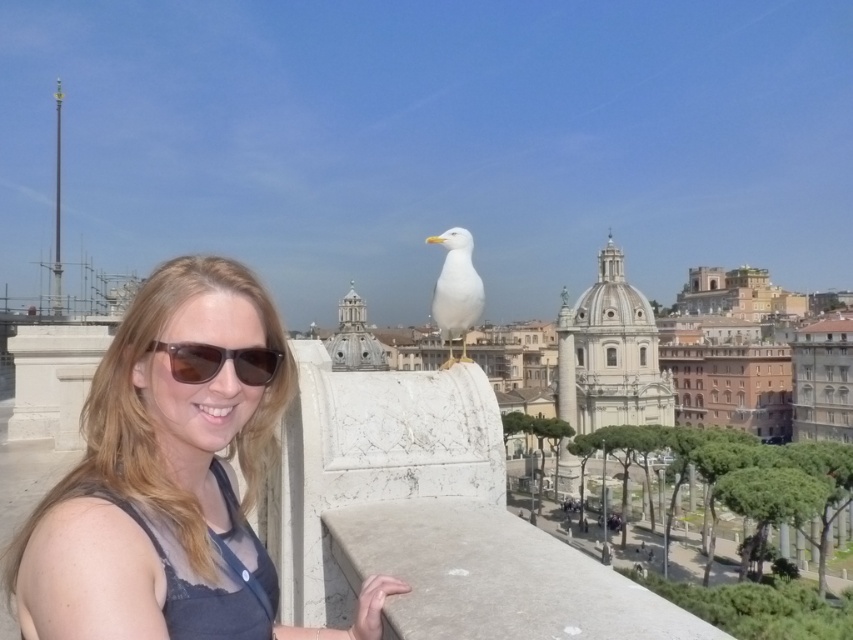
Question: Can you confirm if matte gray tank top at center is positioned below brown matte sunglasses at center?

Choices:
 (A) no
 (B) yes

Answer: (B)

Question: Which object appears closest to the camera in this image?

Choices:
 (A) matte gray tank top at center
 (B) white matte bird at center

Answer: (A)

Question: Which point is farther to the camera?

Choices:
 (A) brown matte sunglasses at center
 (B) matte gray tank top at center
 (C) white matte bird at center

Answer: (C)

Question: In this image, where is white matte bird at center located relative to brown matte sunglasses at center?

Choices:
 (A) right
 (B) left

Answer: (A)

Question: Can you confirm if matte gray tank top at center is positioned above white matte bird at center?

Choices:
 (A) no
 (B) yes

Answer: (A)

Question: Which of the following is the closest to the observer?

Choices:
 (A) (103, 467)
 (B) (465, 228)
 (C) (251, 355)

Answer: (A)